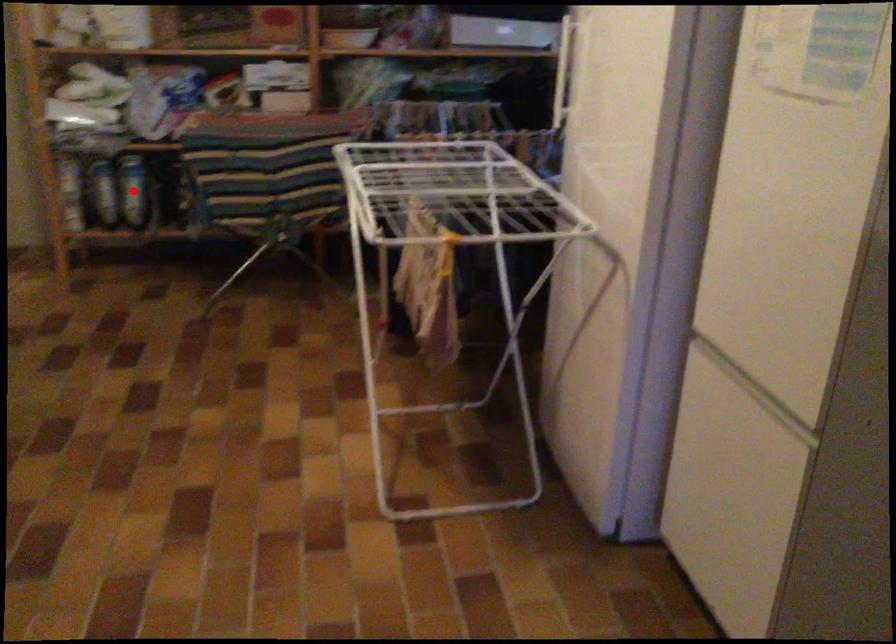
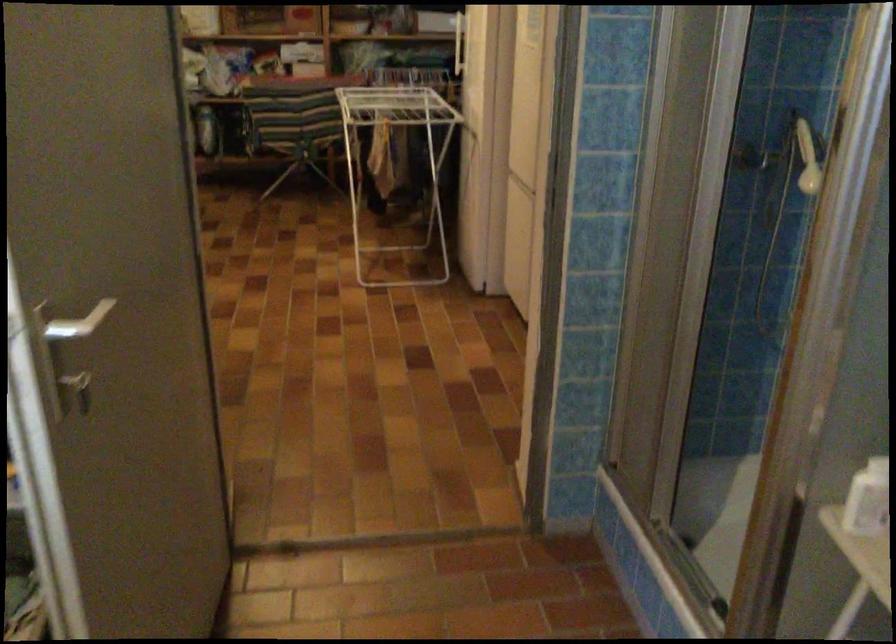
Question: I am providing you with two images of the same scene from different viewpoints. A red point is marked on the first image. Is the red point's position out of view in image 2?

Choices:
 (A) Yes
 (B) No

Answer: (A)